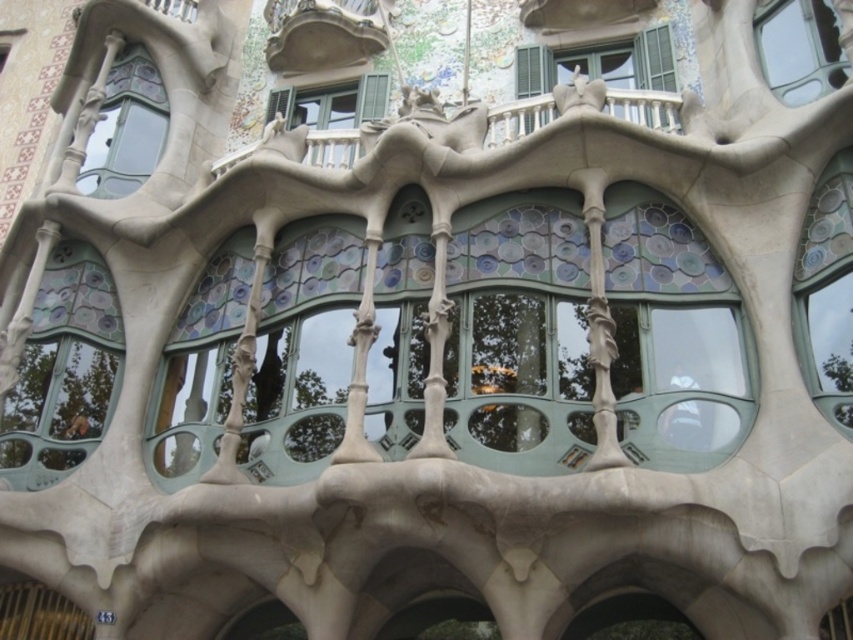
Question: Which point is closer to the camera?

Choices:
 (A) blue glass window at upper left
 (B) blue mosaic tiles at right
 (C) translucent glass window at left

Answer: (B)

Question: From the image, what is the correct spatial relationship of matte stone balcony at upper center in relation to clear glass window at upper right?

Choices:
 (A) left
 (B) right

Answer: (A)

Question: Which point is farther from the camera taking this photo?

Choices:
 (A) (49, 472)
 (B) (122, 122)
 (C) (273, 68)

Answer: (C)

Question: Does blue mosaic tiles at right appear on the left side of blue glass window at upper left?

Choices:
 (A) no
 (B) yes

Answer: (A)

Question: Estimate the real-world distances between objects in this image. Which object is closer to the green matte window at upper center?

Choices:
 (A) matte stone balcony at upper center
 (B) clear glass window at upper right
 (C) matte glass window at upper center

Answer: (B)

Question: Is blue glass window at upper left to the left of matte glass window at upper center from the viewer's perspective?

Choices:
 (A) no
 (B) yes

Answer: (B)